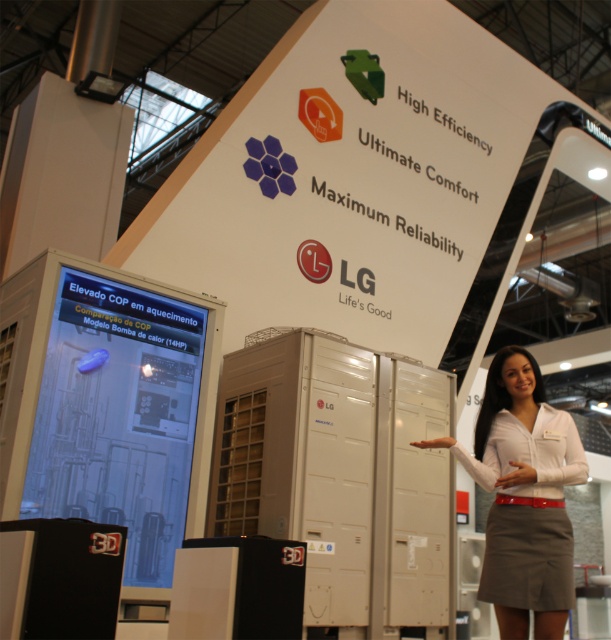
You are a photographer setting up a shot of the LG HVAC display. You want to focus on the point at (419, 211) and the point at (514, 515). Which point should you focus on first to ensure both are in sharp focus?

You should focus on the point at (419, 211) first because it is closer to the camera than the point at (514, 515). By focusing on the closer point, the farther point will also be in focus if within the depth of field.

You are a graphic designer working on a project that requires precise placement of elements. You need to place a new element exactly at the same position as the white paper at upper center. What are the coordinates where you should place the new element?

The white paper at upper center is positioned at coordinates point (351,179), so you should place the new element at those exact coordinates.